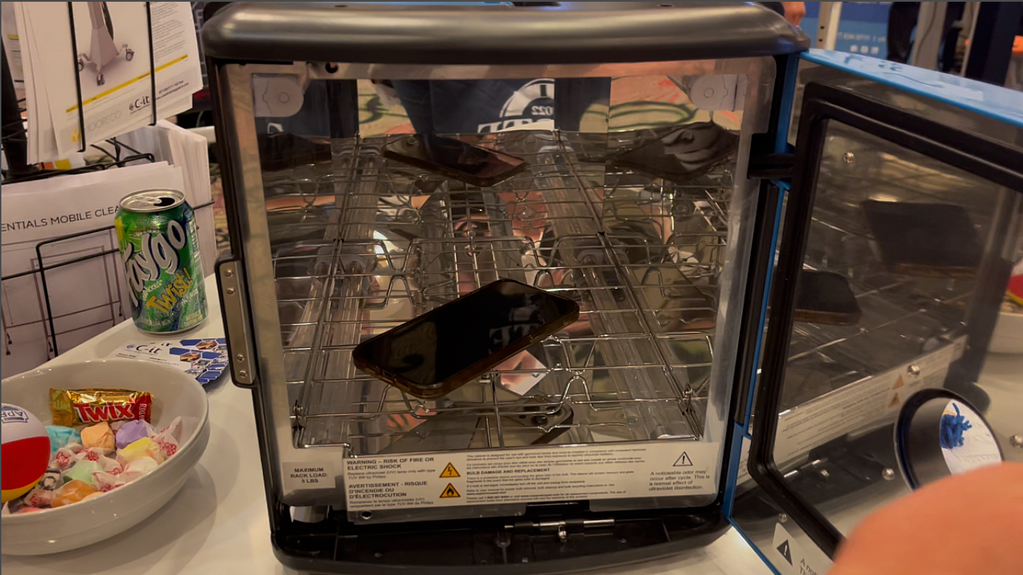
Image resolution: width=1023 pixels, height=575 pixels. What are the coordinates of `rack for papers` in the screenshot? It's located at (42, 274).